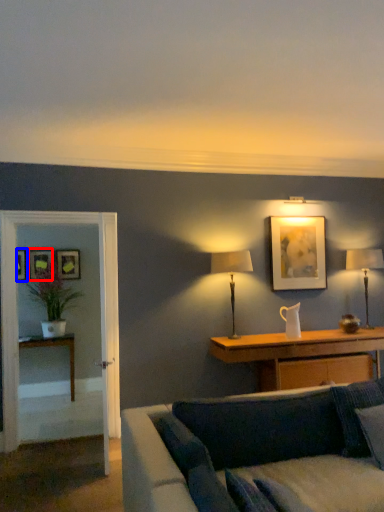
Question: Which object is further to the camera taking this photo, picture frame (highlighted by a red box) or picture frame (highlighted by a blue box)?

Choices:
 (A) picture frame
 (B) picture frame

Answer: (A)